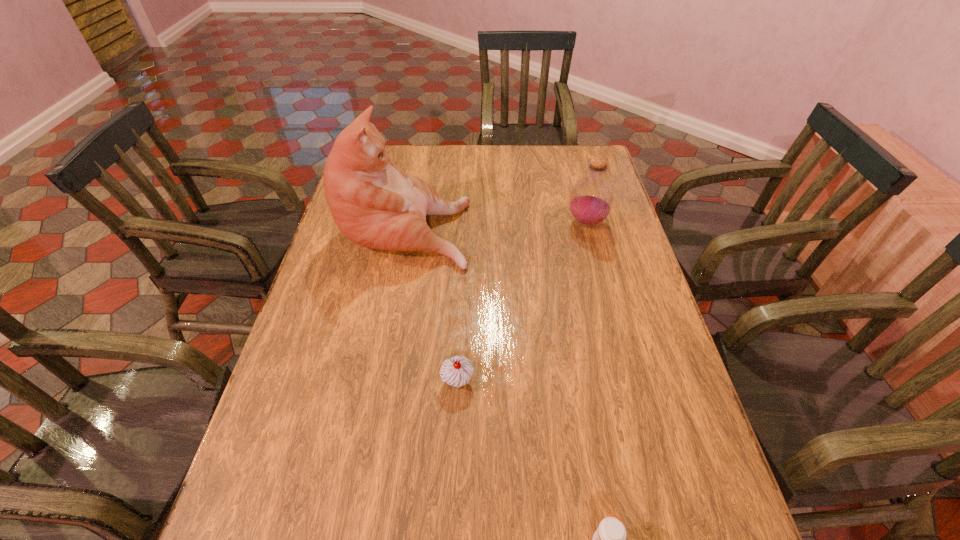
Identify the location of the tallest object. (375, 204).

Locate an element on the screen. This screenshot has width=960, height=540. the rightmost object is located at coordinates (591, 199).

Where is `the third shortest object`? This screenshot has height=540, width=960. the third shortest object is located at coordinates (591, 199).

I want to click on the third tallest object, so click(x=457, y=371).

This screenshot has height=540, width=960. Identify the location of cupcake. (457, 371).

Where is `vacant space situated 0.070m on the face of the cat`? The image size is (960, 540). vacant space situated 0.070m on the face of the cat is located at coordinates (492, 226).

Locate an element on the screen. Image resolution: width=960 pixels, height=540 pixels. vacant point located on the back of the bottle is located at coordinates (570, 165).

This screenshot has height=540, width=960. I want to click on free point located 0.390m on the right of the third farthest object, so click(x=643, y=381).

Where is `object that is at the left edge`? This screenshot has height=540, width=960. object that is at the left edge is located at coordinates (375, 204).

Find the location of a particular element. object located in the right edge section of the desktop is located at coordinates (591, 199).